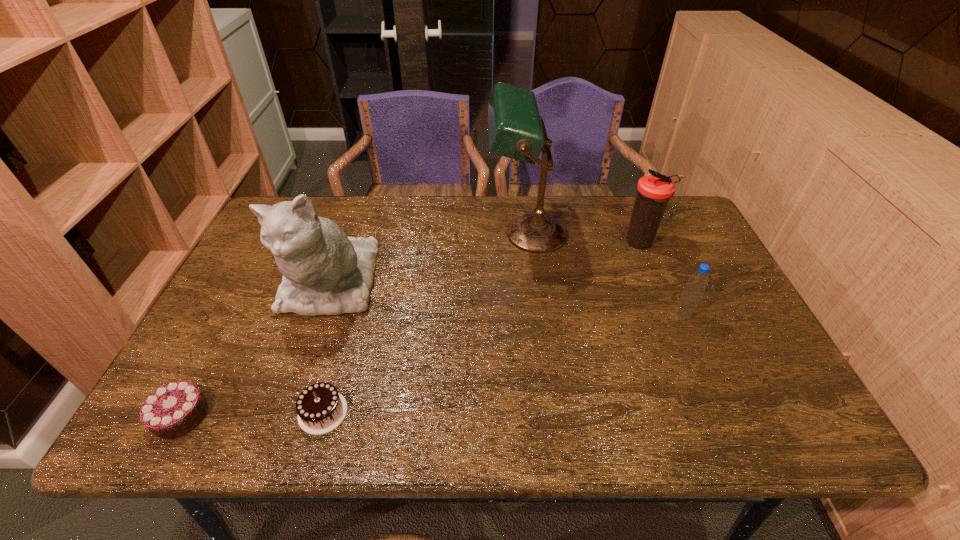
At what (x,y) coordinates should I click in order to perform the action: click on object that can be found as the second closest to the third object from right to left. Please return your answer as a coordinate pair (x, y). Looking at the image, I should click on (696, 284).

Locate an element on the screen. This screenshot has width=960, height=540. blank space that satisfies the following two spatial constraints: 1. above the green lampshade of the tallest object; 2. on the back side of the water bottle is located at coordinates (537, 315).

Locate an element on the screen. This screenshot has width=960, height=540. vacant area that satisfies the following two spatial constraints: 1. above the green lampshade of the thermos bottle; 2. on the right side of the tallest object is located at coordinates (x=528, y=243).

What are the coordinates of `vacant region that satisfies the following two spatial constraints: 1. on the front-facing side of the cat; 2. on the left side of the third shortest object` in the screenshot? It's located at (319, 315).

Locate an element on the screen. vacant space that satisfies the following two spatial constraints: 1. on the front-facing side of the second tallest object; 2. on the left side of the right chocolate cake is located at coordinates (285, 412).

Find the location of `vacant area in the image that satisfies the following two spatial constraints: 1. on the back side of the right chocolate cake; 2. on the right side of the leftmost object`. vacant area in the image that satisfies the following two spatial constraints: 1. on the back side of the right chocolate cake; 2. on the right side of the leftmost object is located at coordinates (182, 412).

The width and height of the screenshot is (960, 540). Find the location of `free space that satisfies the following two spatial constraints: 1. on the front-facing side of the right chocolate cake; 2. on the right side of the cat`. free space that satisfies the following two spatial constraints: 1. on the front-facing side of the right chocolate cake; 2. on the right side of the cat is located at coordinates (285, 412).

Where is `free space that satisfies the following two spatial constraints: 1. above the green lampshade of the table lamp; 2. on the front side of the right chocolate cake`? free space that satisfies the following two spatial constraints: 1. above the green lampshade of the table lamp; 2. on the front side of the right chocolate cake is located at coordinates (549, 412).

Locate an element on the screen. vacant space that satisfies the following two spatial constraints: 1. above the green lampshade of the tallest object; 2. on the right side of the water bottle is located at coordinates (537, 315).